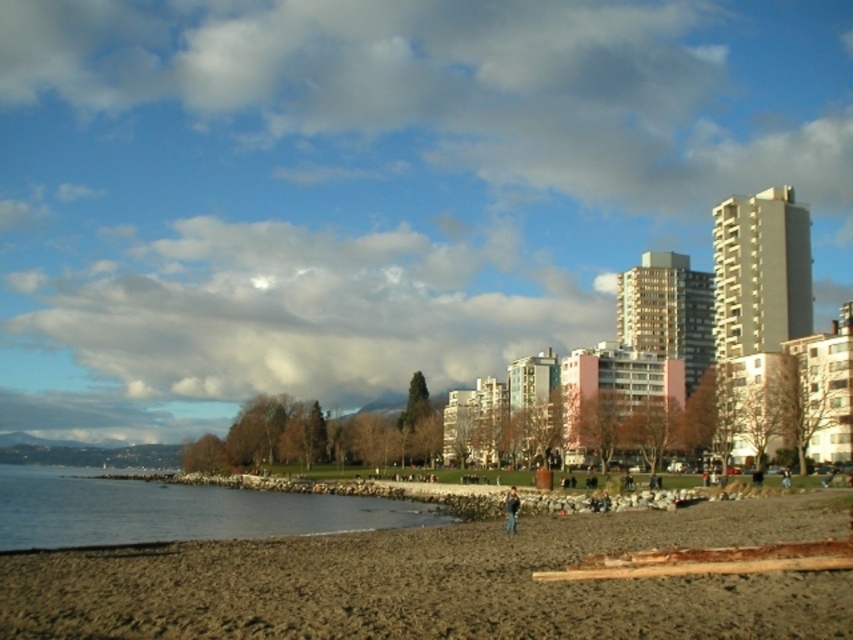
Who is lower down, brown sandy beach at lower left or dark brown leather jacket at lower center?

Positioned lower is dark brown leather jacket at lower center.

Who is more distant from viewer, (350,540) or (509,506)?

Positioned behind is point (350,540).

Locate an element on the screen. brown sandy beach at lower left is located at coordinates click(438, 582).

Consider the image. Measure the distance between clear water at lower left and dark brown leather jacket at lower center.

clear water at lower left is 160.07 feet from dark brown leather jacket at lower center.

Does point (352, 502) come in front of point (505, 502)?

That is False.

Identify the location of clear water at lower left. Image resolution: width=853 pixels, height=640 pixels. (175, 509).

Is brown sandy beach at lower left positioned in front of clear water at lower left?

Yes, it is in front of clear water at lower left.

Can you confirm if brown sandy beach at lower left is shorter than clear water at lower left?

Indeed, brown sandy beach at lower left has a lesser height compared to clear water at lower left.

Does point (456, 593) come closer to viewer compared to point (300, 509)?

Yes.

I want to click on brown sandy beach at lower left, so click(x=438, y=582).